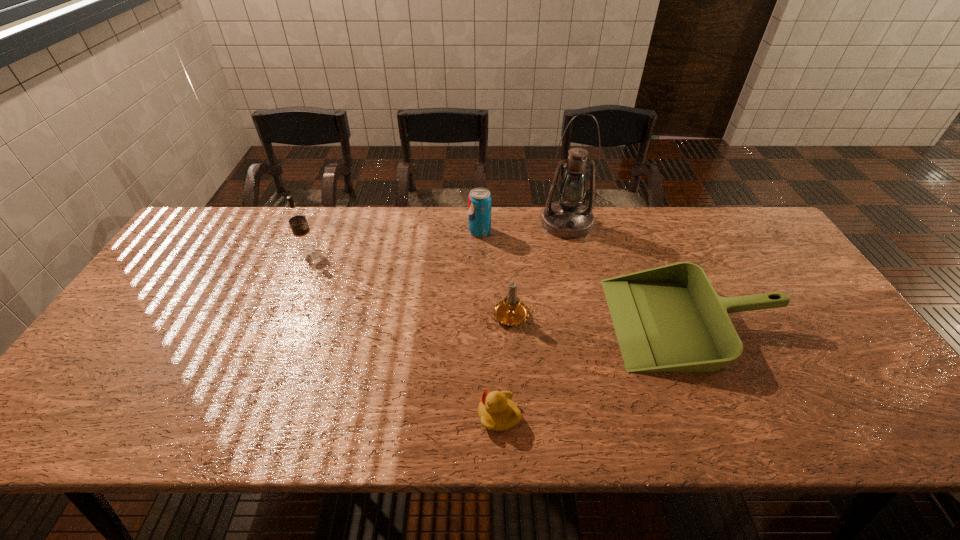
The height and width of the screenshot is (540, 960). I want to click on free spot that satisfies the following two spatial constraints: 1. on the front side of the oil lamp; 2. on the front-facing side of the nearest object, so click(612, 415).

I want to click on free point that satisfies the following two spatial constraints: 1. on the back side of the tallest object; 2. on the right side of the fourth shortest object, so click(x=480, y=223).

Where is `vacant space that satisfies the following two spatial constraints: 1. on the label of the fourth tallest object; 2. on the right side of the third farthest object`? vacant space that satisfies the following two spatial constraints: 1. on the label of the fourth tallest object; 2. on the right side of the third farthest object is located at coordinates (278, 315).